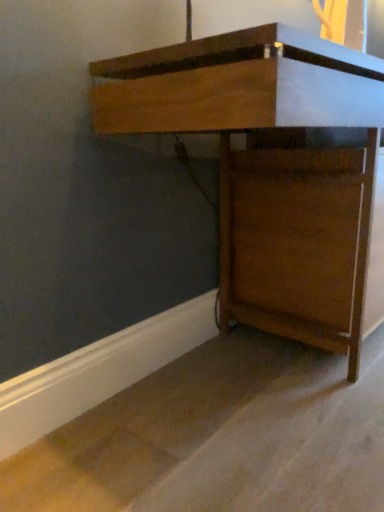
Question: Is wooden desk at center bigger than brown wood cabinet at lower right?

Choices:
 (A) yes
 (B) no

Answer: (A)

Question: From a real-world perspective, is wooden desk at center physically above brown wood cabinet at lower right?

Choices:
 (A) no
 (B) yes

Answer: (B)

Question: Is wooden desk at center thinner than brown wood cabinet at lower right?

Choices:
 (A) yes
 (B) no

Answer: (A)

Question: Does wooden desk at center come behind brown wood cabinet at lower right?

Choices:
 (A) no
 (B) yes

Answer: (B)

Question: Can you confirm if wooden desk at center is wider than brown wood cabinet at lower right?

Choices:
 (A) no
 (B) yes

Answer: (A)

Question: From the image's perspective, does wooden desk at center appear lower than brown wood cabinet at lower right?

Choices:
 (A) yes
 (B) no

Answer: (B)

Question: Is there a large distance between brown wood cabinet at lower right and wooden desk at center?

Choices:
 (A) no
 (B) yes

Answer: (A)

Question: Is brown wood cabinet at lower right positioned behind wooden desk at center?

Choices:
 (A) no
 (B) yes

Answer: (A)

Question: Is brown wood cabinet at lower right positioned before wooden desk at center?

Choices:
 (A) no
 (B) yes

Answer: (B)

Question: From the image's perspective, is brown wood cabinet at lower right below wooden desk at center?

Choices:
 (A) no
 (B) yes

Answer: (B)

Question: Does brown wood cabinet at lower right appear on the right side of wooden desk at center?

Choices:
 (A) yes
 (B) no

Answer: (B)

Question: From a real-world perspective, is brown wood cabinet at lower right physically above wooden desk at center?

Choices:
 (A) yes
 (B) no

Answer: (B)

Question: From the image's perspective, is brown wood cabinet at lower right above or below wooden desk at center?

Choices:
 (A) above
 (B) below

Answer: (B)